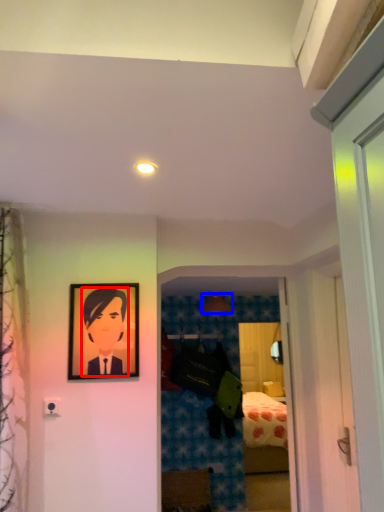
Question: Which object is closer to the camera taking this photo, person (highlighted by a red box) or lamp (highlighted by a blue box)?

Choices:
 (A) person
 (B) lamp

Answer: (A)